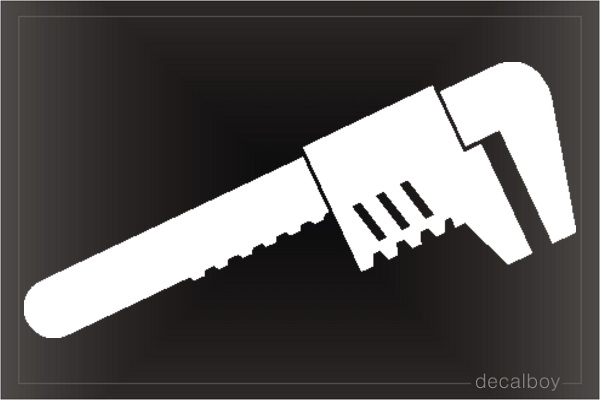
The width and height of the screenshot is (600, 400). In order to click on handle in this screenshot , I will do click(74, 294), click(151, 272), click(216, 234), click(300, 202).